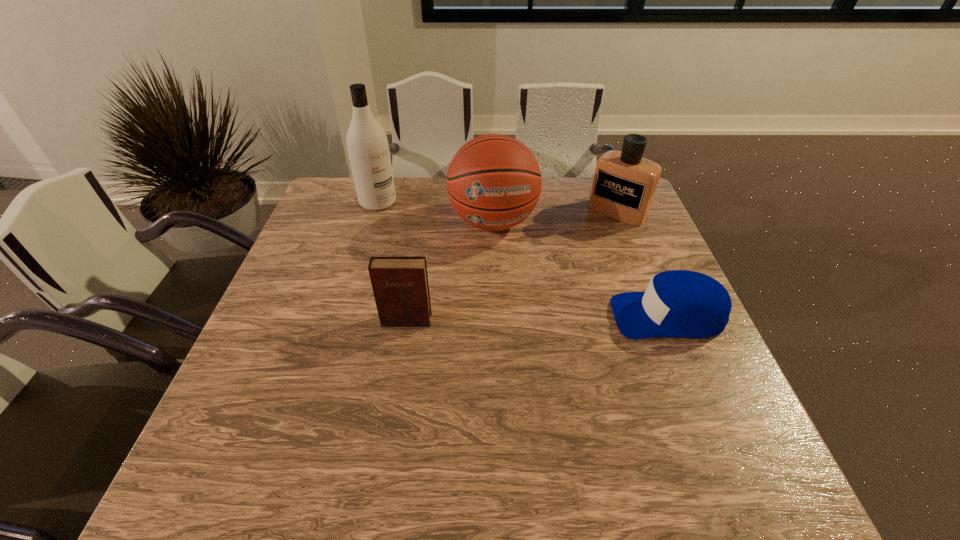
The width and height of the screenshot is (960, 540). I want to click on unoccupied position between the perfume and the basketball, so click(x=555, y=217).

I want to click on object that stands as the third closest to the baseball cap, so click(x=400, y=285).

The image size is (960, 540). In order to click on object that is the second closest to the shampoo in this screenshot , I will do `click(400, 285)`.

This screenshot has width=960, height=540. I want to click on free spot that satisfies the following two spatial constraints: 1. on the front side of the perfume; 2. on the front-facing side of the shortest object, so click(659, 315).

Where is `vacant space that satisfies the following two spatial constraints: 1. on the front side of the shortest object; 2. on the front-facing side of the third object from left to right`? Image resolution: width=960 pixels, height=540 pixels. vacant space that satisfies the following two spatial constraints: 1. on the front side of the shortest object; 2. on the front-facing side of the third object from left to right is located at coordinates [496, 315].